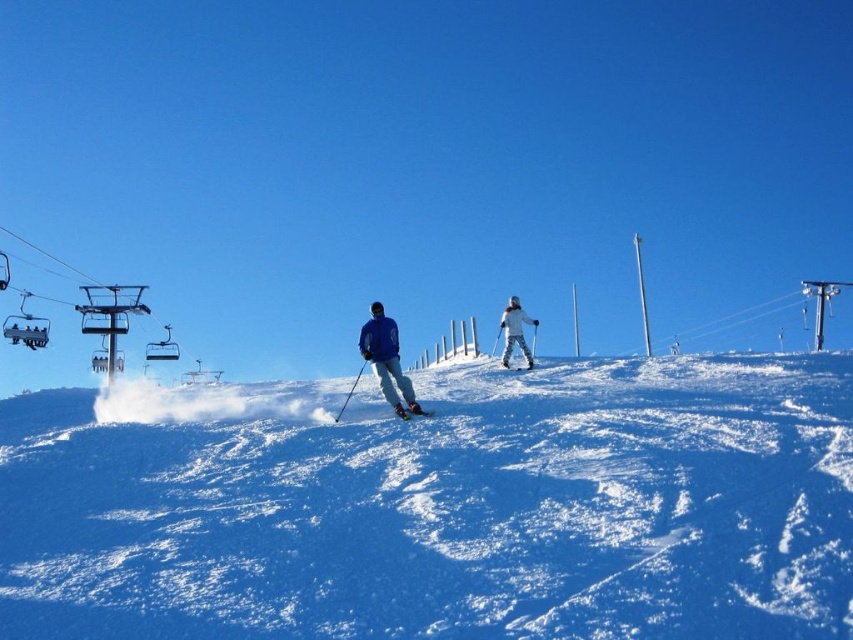
Question: Can you confirm if white powdery snow at center is positioned below blue matte jacket at center?

Choices:
 (A) no
 (B) yes

Answer: (B)

Question: Does white powdery snow at center have a greater width compared to white snowsuit at center?

Choices:
 (A) no
 (B) yes

Answer: (B)

Question: Does white powdery snow at center appear over white matte ski at center?

Choices:
 (A) yes
 (B) no

Answer: (B)

Question: Estimate the real-world distances between objects in this image. Which object is farther from the white powdery snow at center?

Choices:
 (A) matte blue ski at center
 (B) blue matte jacket at center
 (C) white snowsuit at center

Answer: (C)

Question: Estimate the real-world distances between objects in this image. Which object is closer to the white matte ski at center?

Choices:
 (A) white powdery snow at center
 (B) white snowsuit at center

Answer: (B)

Question: Which is nearer to the white powdery snow at center?

Choices:
 (A) matte blue ski at center
 (B) white matte ski at center
 (C) blue matte jacket at center
 (D) white snowsuit at center

Answer: (C)